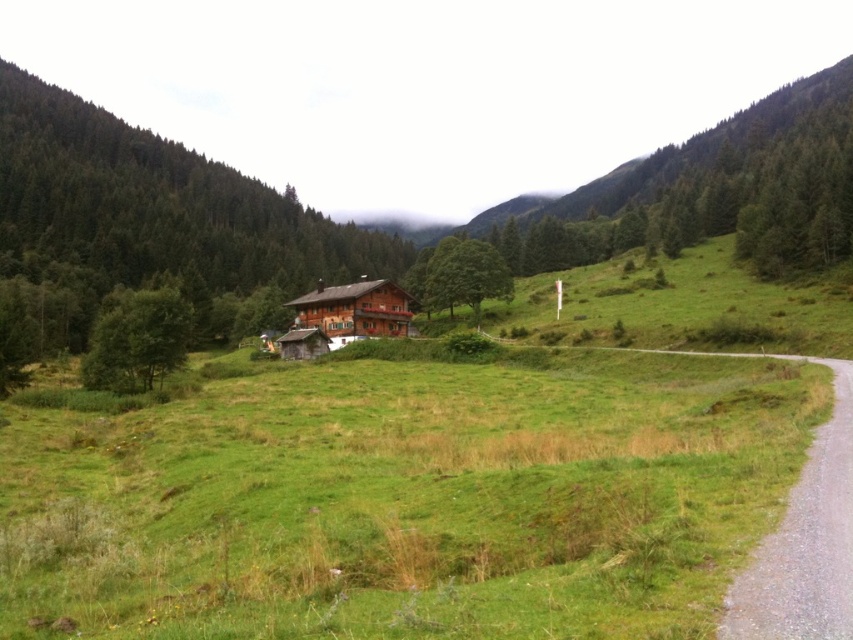
Question: Does wooden cabin at center have a greater width compared to green leafy tree at center?

Choices:
 (A) no
 (B) yes

Answer: (B)

Question: Which of these objects is positioned farthest from the gravel road at right?

Choices:
 (A) wooden cabin at center
 (B) green leafy tree at left
 (C) green leafy tree at center

Answer: (C)

Question: Which of the following is the closest to the observer?

Choices:
 (A) (440, 266)
 (B) (817, 557)
 (C) (86, 356)

Answer: (B)

Question: Considering the relative positions of green grassy field at center and green leafy tree at center in the image provided, where is green grassy field at center located with respect to green leafy tree at center?

Choices:
 (A) left
 (B) right

Answer: (A)

Question: Does green grassy field at center have a larger size compared to wooden cabin at center?

Choices:
 (A) yes
 (B) no

Answer: (A)

Question: Which of these objects is positioned farthest from the green leafy tree at center?

Choices:
 (A) wooden cabin at center
 (B) green leafy tree at left
 (C) gravel road at right
 (D) green grassy field at center

Answer: (C)